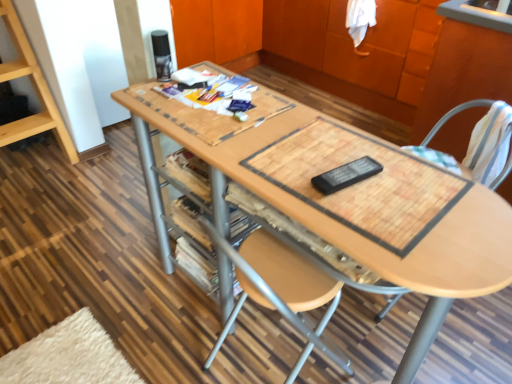
Question: Could you tell me if wooden at right is turned towards wooden table at center?

Choices:
 (A) no
 (B) yes

Answer: (B)

Question: Is wooden at right shorter than wooden table at center?

Choices:
 (A) no
 (B) yes

Answer: (A)

Question: Considering the relative sizes of wooden at right and wooden table at center in the image provided, is wooden at right wider than wooden table at center?

Choices:
 (A) no
 (B) yes

Answer: (B)

Question: From the image's perspective, is wooden at right located above wooden table at center?

Choices:
 (A) yes
 (B) no

Answer: (A)

Question: Is wooden at right at the left side of wooden table at center?

Choices:
 (A) yes
 (B) no

Answer: (B)

Question: From a real-world perspective, relative to wooden table at center, is bamboo placemat at center vertically above or below?

Choices:
 (A) above
 (B) below

Answer: (A)

Question: Does point (402, 162) appear closer or farther from the camera than point (461, 228)?

Choices:
 (A) farther
 (B) closer

Answer: (A)

Question: Considering the positions of bamboo placemat at center and wooden table at center in the image, is bamboo placemat at center bigger or smaller than wooden table at center?

Choices:
 (A) big
 (B) small

Answer: (B)

Question: Is bamboo placemat at center inside the boundaries of wooden table at center, or outside?

Choices:
 (A) outside
 (B) inside

Answer: (B)

Question: In terms of height, does wooden table at center look taller or shorter compared to wooden cabinet at upper center?

Choices:
 (A) tall
 (B) short

Answer: (B)

Question: From the image's perspective, is wooden table at center located above or below wooden cabinet at upper center?

Choices:
 (A) below
 (B) above

Answer: (A)

Question: From a real-world perspective, is wooden table at center above or below wooden cabinet at upper center?

Choices:
 (A) above
 (B) below

Answer: (B)

Question: Is wooden table at center to the left or to the right of wooden cabinet at upper center in the image?

Choices:
 (A) right
 (B) left

Answer: (B)

Question: Is bamboo placemat at center inside or outside of wooden cabinet at upper center?

Choices:
 (A) outside
 (B) inside

Answer: (A)

Question: From the image's perspective, is bamboo placemat at center positioned above or below wooden cabinet at upper center?

Choices:
 (A) above
 (B) below

Answer: (B)